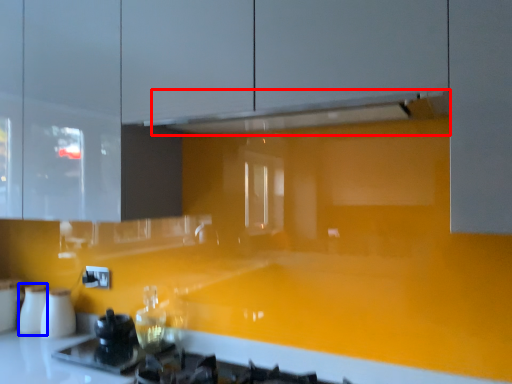
Question: Which object is closer to the camera taking this photo, exhaust hood (highlighted by a red box) or appliance (highlighted by a blue box)?

Choices:
 (A) exhaust hood
 (B) appliance

Answer: (A)